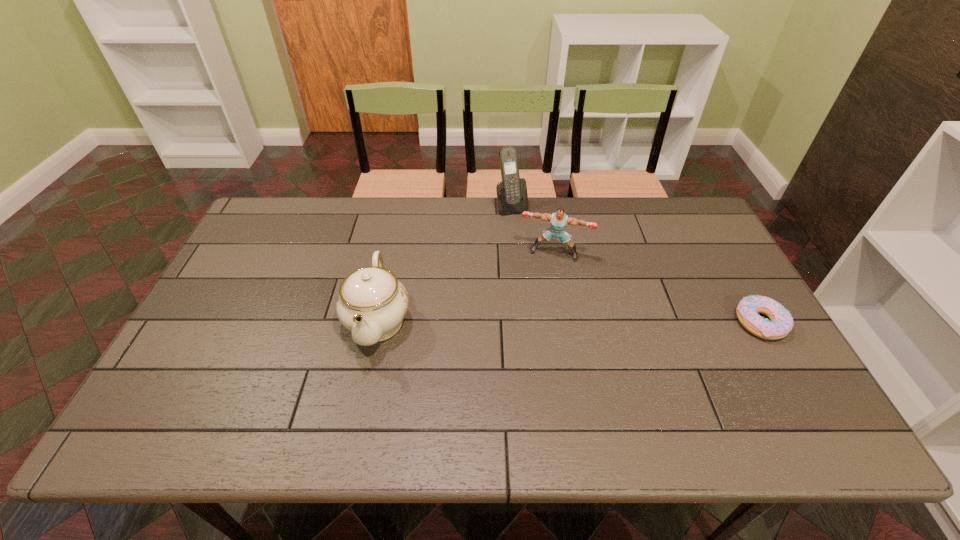
This screenshot has height=540, width=960. I want to click on free spot between the cellular telephone and the doughnut, so click(x=636, y=264).

The height and width of the screenshot is (540, 960). Identify the location of vacant space that's between the leftmost object and the cellular telephone. (444, 263).

I want to click on vacant region between the chinaware and the puncher, so click(467, 287).

Where is `vacant space in between the doughnut and the third nearest object`? vacant space in between the doughnut and the third nearest object is located at coordinates (657, 288).

Identify the location of unoccupied position between the puncher and the farthest object. (533, 230).

The height and width of the screenshot is (540, 960). Identify the location of free area in between the farthest object and the leftmost object. (444, 263).

Where is `empty space between the cellular telephone and the leftmost object`? This screenshot has height=540, width=960. empty space between the cellular telephone and the leftmost object is located at coordinates (444, 263).

In order to click on free space between the farthest object and the puncher in this screenshot , I will do `click(533, 230)`.

At what (x,y) coordinates should I click in order to perform the action: click on blank region between the farthest object and the chinaware. Please return your answer as a coordinate pair (x, y). This screenshot has height=540, width=960. Looking at the image, I should click on (444, 263).

The image size is (960, 540). Identify the location of free spot between the shortest object and the leftmost object. (569, 321).